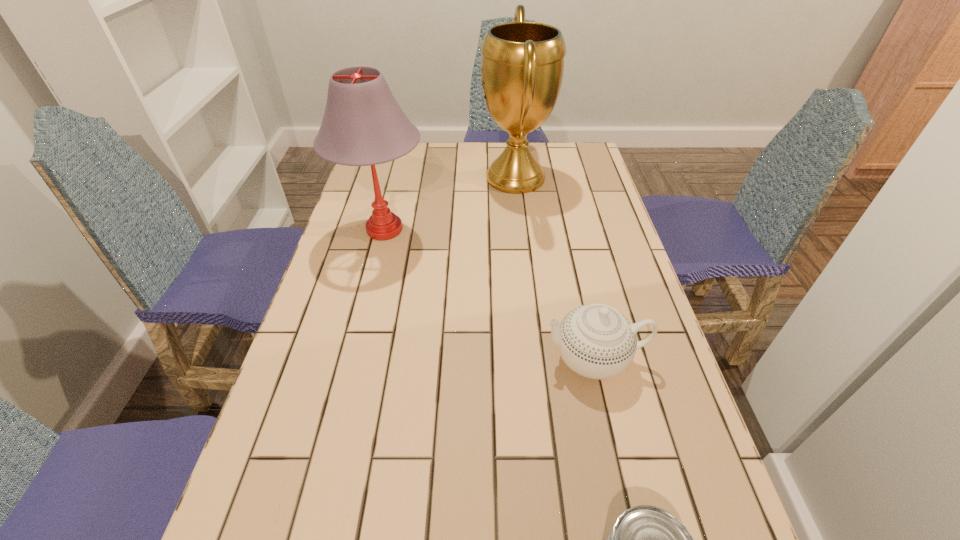
Where is `free spot located 0.320m on the spout of the second nearest object`? free spot located 0.320m on the spout of the second nearest object is located at coordinates (396, 359).

The image size is (960, 540). I want to click on object located at the far edge, so click(522, 65).

You are a GUI agent. You are given a task and a screenshot of the screen. Output one action in this format:
    pyautogui.click(x=<x>, y=<y>)
    Task: Click on the object that is at the left edge
    The width and height of the screenshot is (960, 540).
    Given the screenshot: What is the action you would take?
    pyautogui.click(x=363, y=124)

This screenshot has height=540, width=960. I want to click on object positioned at the right edge, so click(x=596, y=341).

In the image, there is a desktop. Where is `free space at the far edge`? free space at the far edge is located at coordinates (x=485, y=166).

The image size is (960, 540). What are the coordinates of `free space at the left edge` in the screenshot? It's located at (359, 369).

The height and width of the screenshot is (540, 960). In the image, there is a desktop. In order to click on free space at the right edge in this screenshot , I will do `click(601, 263)`.

This screenshot has height=540, width=960. In order to click on vacant area at the far right corner of the desktop in this screenshot , I will do `click(576, 144)`.

Locate an element on the screen. This screenshot has height=540, width=960. free point between the chinaware and the trophy cup is located at coordinates (555, 268).

Where is `vacant area that lies between the leftmost object and the second shortest object`? The height and width of the screenshot is (540, 960). vacant area that lies between the leftmost object and the second shortest object is located at coordinates 490,294.